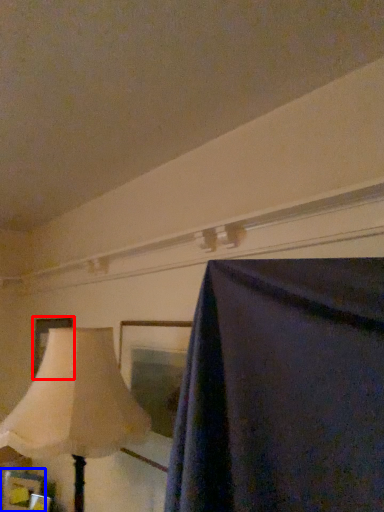
Question: Among these objects, which one is nearest to the camera, picture frame (highlighted by a red box) or picture frame (highlighted by a blue box)?

Choices:
 (A) picture frame
 (B) picture frame

Answer: (B)